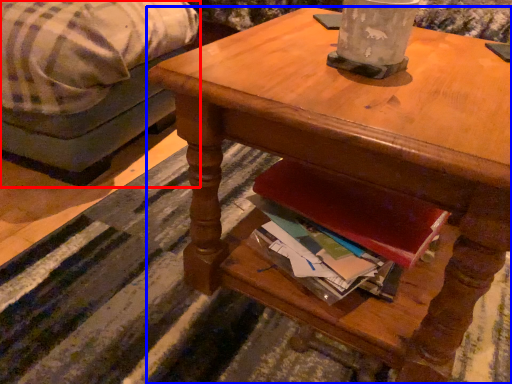
Question: Which object is further to the camera taking this photo, studio couch (highlighted by a red box) or desk (highlighted by a blue box)?

Choices:
 (A) studio couch
 (B) desk

Answer: (A)